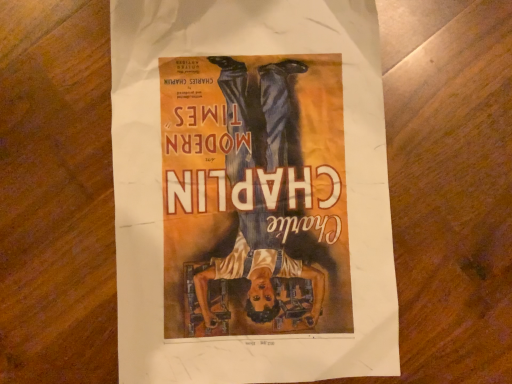
The height and width of the screenshot is (384, 512). I want to click on matte paper poster at center, so click(251, 192).

This screenshot has width=512, height=384. Describe the element at coordinates (251, 192) in the screenshot. I see `matte paper poster at center` at that location.

Locate an element on the screen. matte paper poster at center is located at coordinates (251, 192).